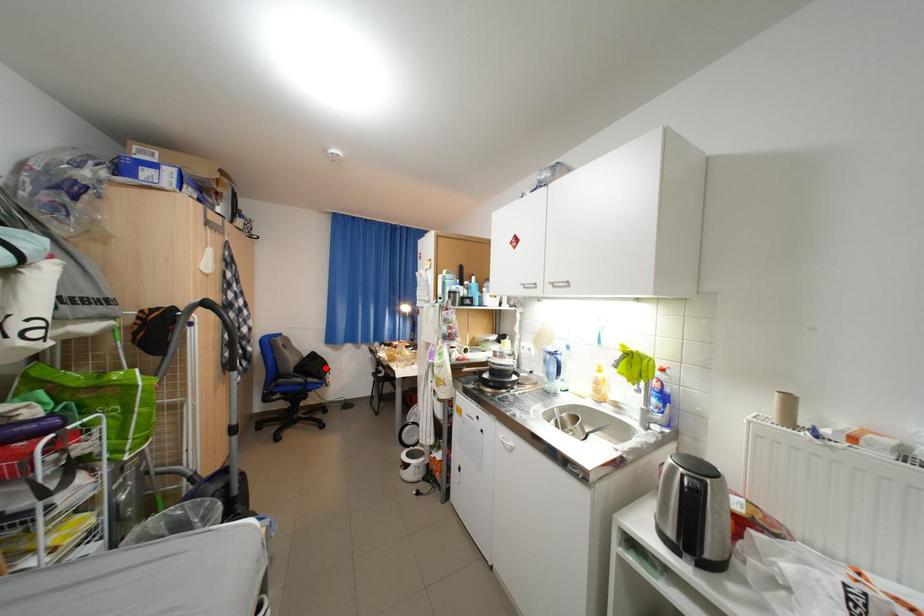
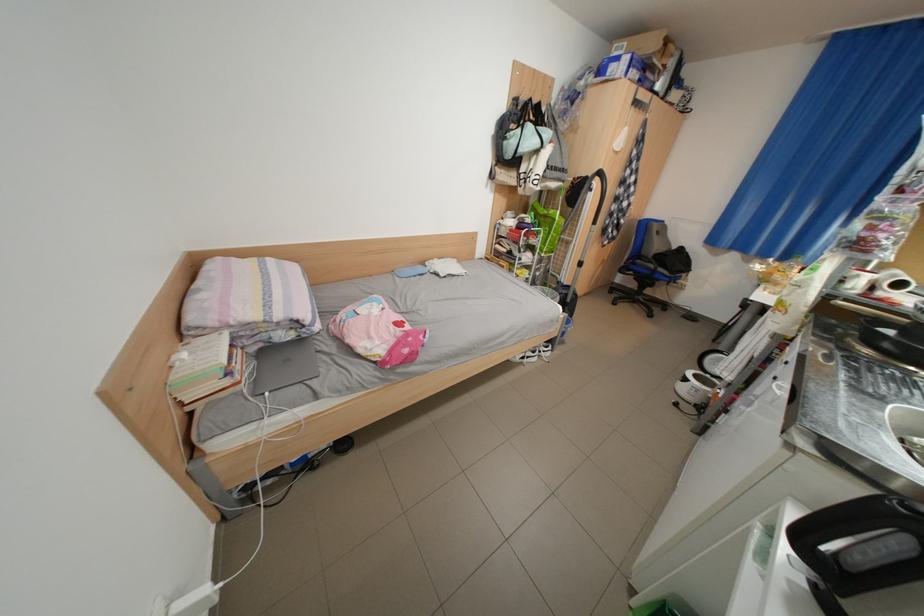
Question: I am providing you with two images of the same scene from different viewpoints. A red point is marked on the first image. Is the red point's position out of view in image 2?

Choices:
 (A) Yes
 (B) No

Answer: (B)